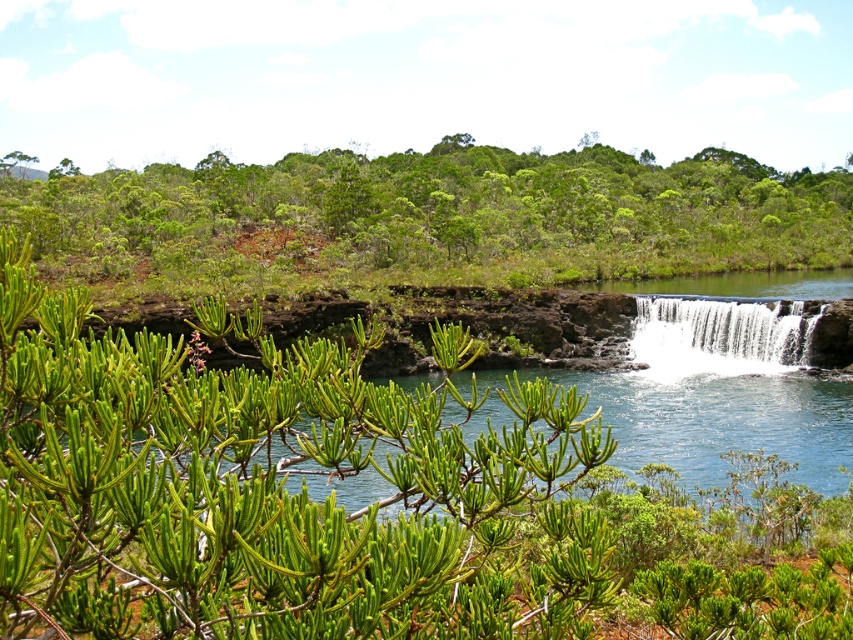
You are standing at the base of the waterfall in the image. You see two points marked in the scene. Which point, point [635,212] or point [717,301], is closer to you?

Point [635,212] is closer to you because it is further to the camera than point [717,301].

You are standing at the edge of the waterfall in the image and want to reach a specific point marked at coordinates point (534, 579). If your maximum comfortable walking distance is 5 meters, can you safely walk to that point?

The distance of point (534, 579) from camera is 4.93 meters, so yes, you can safely walk to that point since it is within your 5 meters comfortable walking distance.

You are standing at the point marked by the coordinates point (x=277, y=486) in the image. What type of vegetation are you currently standing on?

The point (x=277, y=486) is on a green leafy shrub at center.